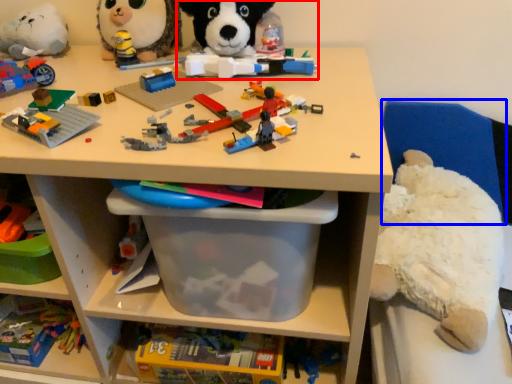
Question: Which of the following is the farthest to the observer, toy (highlighted by a red box) or chair (highlighted by a blue box)?

Choices:
 (A) toy
 (B) chair

Answer: (B)